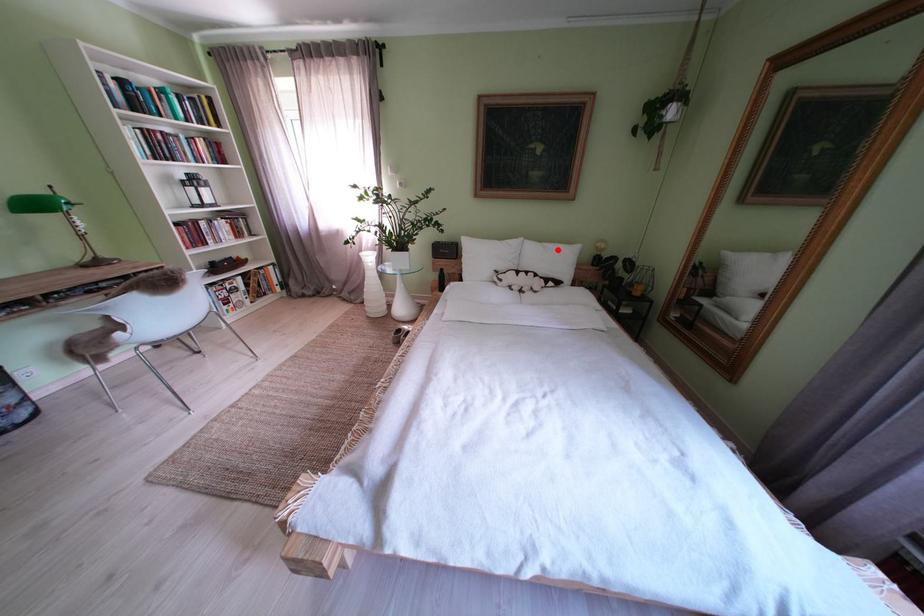
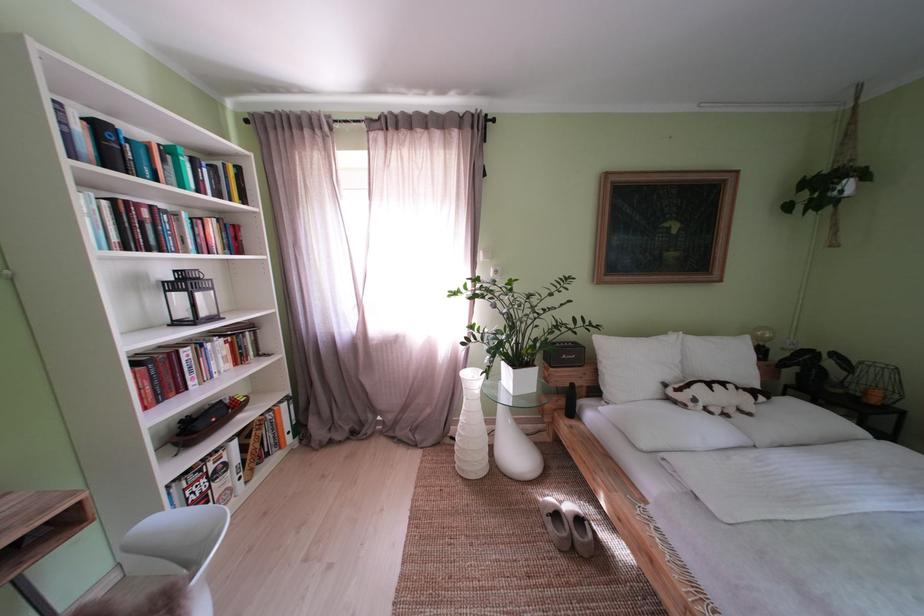
Question: A red point is marked in image1. In image2, is the corresponding 3D point closer to the camera or farther? Reply with the corresponding letter.

Choices:
 (A) The corresponding 3D point is closer.
 (B) The corresponding 3D point is farther.

Answer: (B)